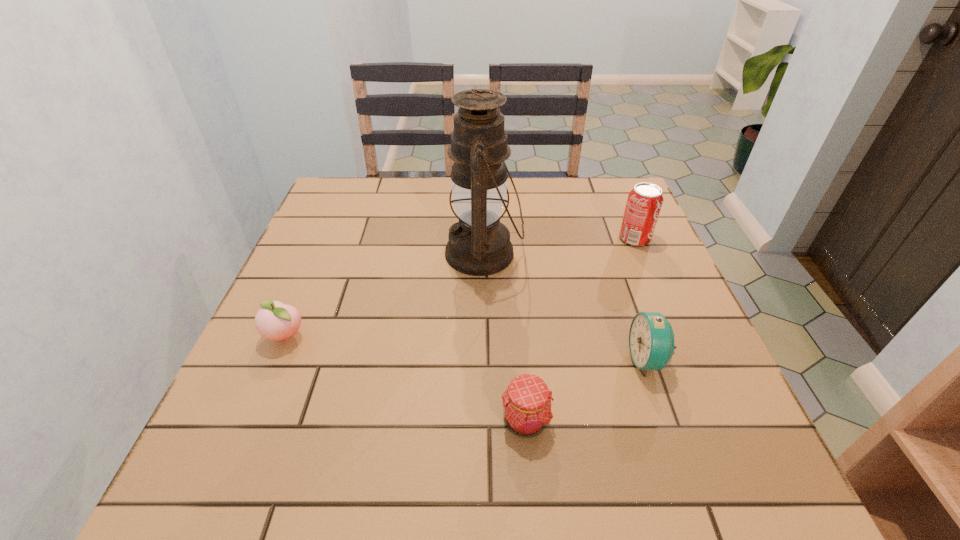
The image size is (960, 540). In the image, there is a desktop. In order to click on free region at the right edge in this screenshot , I will do `click(682, 406)`.

The width and height of the screenshot is (960, 540). In order to click on free space at the far left corner of the desktop in this screenshot , I will do `click(372, 181)`.

Identify the location of free space at the far right corner of the desktop. Image resolution: width=960 pixels, height=540 pixels. (588, 213).

Identify the location of vacant space that's between the tallest object and the alarm clock. (565, 307).

This screenshot has height=540, width=960. What are the coordinates of `free space between the alarm clock and the tallest object` in the screenshot? It's located at (565, 307).

Where is `vacant space in between the nearest object and the peach`? The width and height of the screenshot is (960, 540). vacant space in between the nearest object and the peach is located at coordinates (405, 379).

Where is `free space between the second object from right to left and the tallest object`? The height and width of the screenshot is (540, 960). free space between the second object from right to left and the tallest object is located at coordinates (565, 307).

Locate an element on the screen. Image resolution: width=960 pixels, height=540 pixels. unoccupied position between the third tallest object and the peach is located at coordinates (467, 348).

Identify the location of vacant region between the soda can and the jam. This screenshot has width=960, height=540. (580, 330).

Image resolution: width=960 pixels, height=540 pixels. I want to click on empty location between the nearest object and the soda can, so click(580, 330).